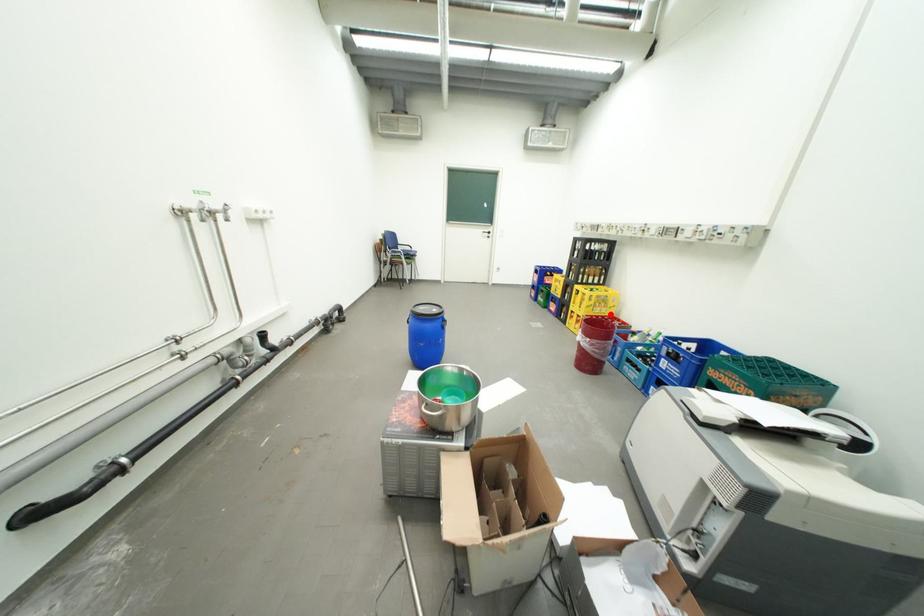
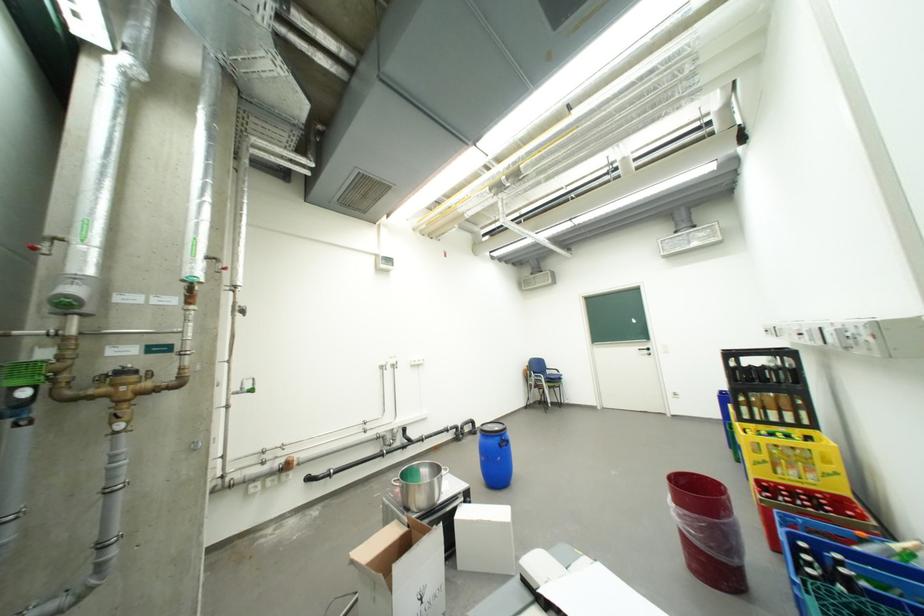
Question: I am providing you with two images of the same scene from different viewpoints. A red point is marked on the first image. At the location where the point appears in image 1, is it still visible in image 2?

Choices:
 (A) Yes
 (B) No

Answer: (A)